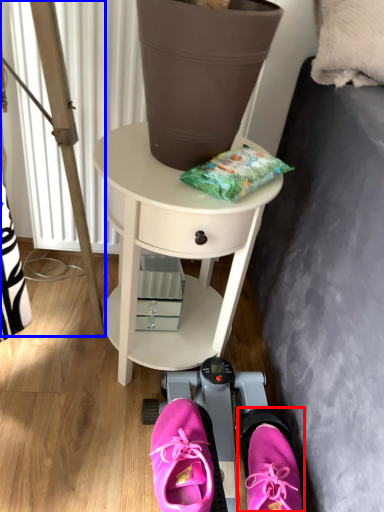
Question: Which object is closer to the camera taking this photo, footwear (highlighted by a red box) or ladder (highlighted by a blue box)?

Choices:
 (A) footwear
 (B) ladder

Answer: (A)